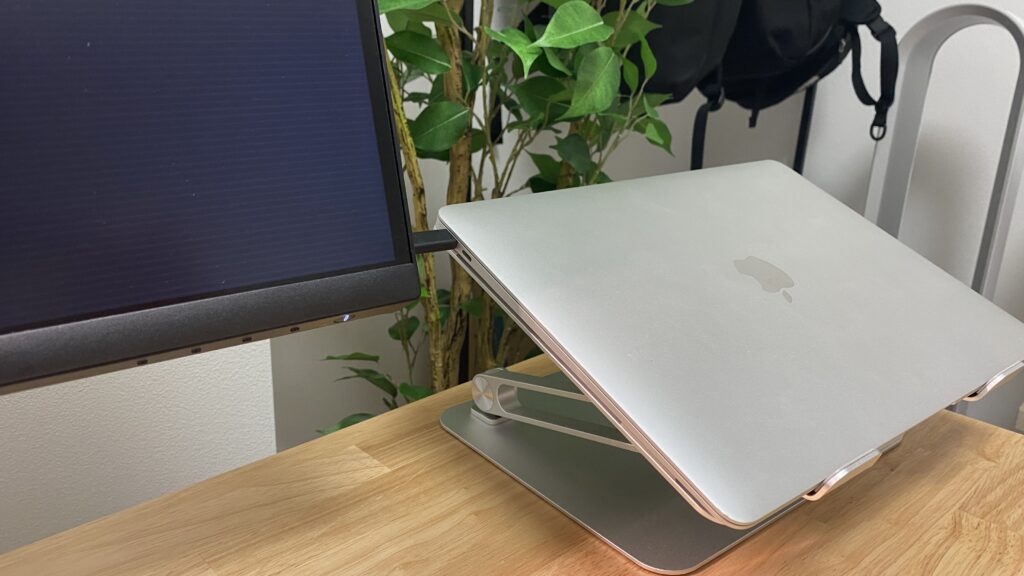
At what (x,y) coordinates should I click in order to perform the action: click on monitor buttons. Please return your answer as a coordinate pair (x, y). Looking at the image, I should click on (139, 361), (189, 348), (240, 338), (296, 325), (342, 314).